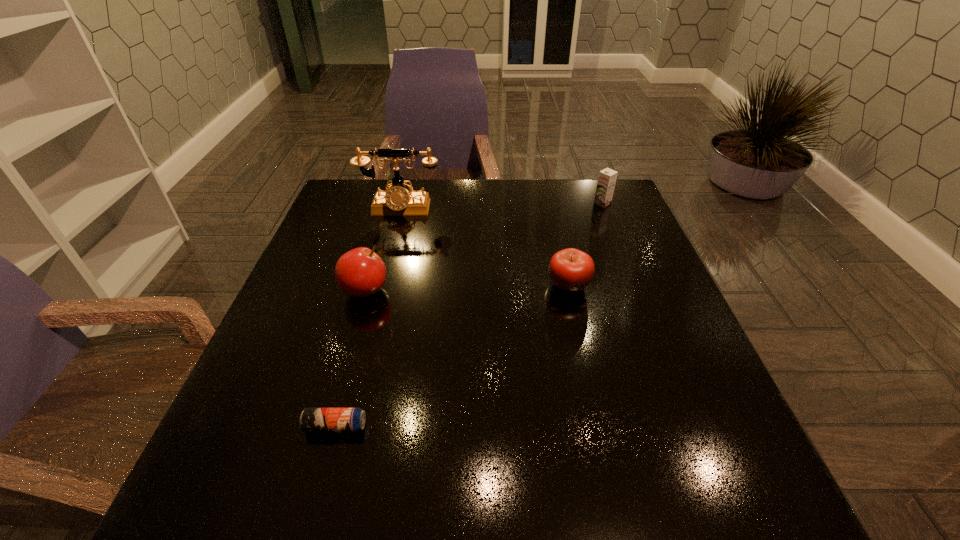
Locate an element on the screen. This screenshot has width=960, height=540. telephone is located at coordinates (396, 201).

Locate an element on the screen. The image size is (960, 540). the rightmost object is located at coordinates (607, 178).

Where is `the left apple`? the left apple is located at coordinates (360, 272).

Where is `the right apple`? the right apple is located at coordinates (570, 269).

Locate an element on the screen. the nearest object is located at coordinates (311, 419).

This screenshot has height=540, width=960. I want to click on the shortest object, so click(x=311, y=419).

Locate an element on the screen. This screenshot has width=960, height=540. vacant space located on the dial of the tallest object is located at coordinates (382, 278).

The image size is (960, 540). I want to click on free space located 0.110m on the back of the rightmost object, so click(593, 181).

Locate an element on the screen. blank space located on the back of the left apple is located at coordinates (393, 195).

This screenshot has width=960, height=540. What are the coordinates of `vacant region located 0.150m on the front of the fourth object from left to right` in the screenshot? It's located at (584, 352).